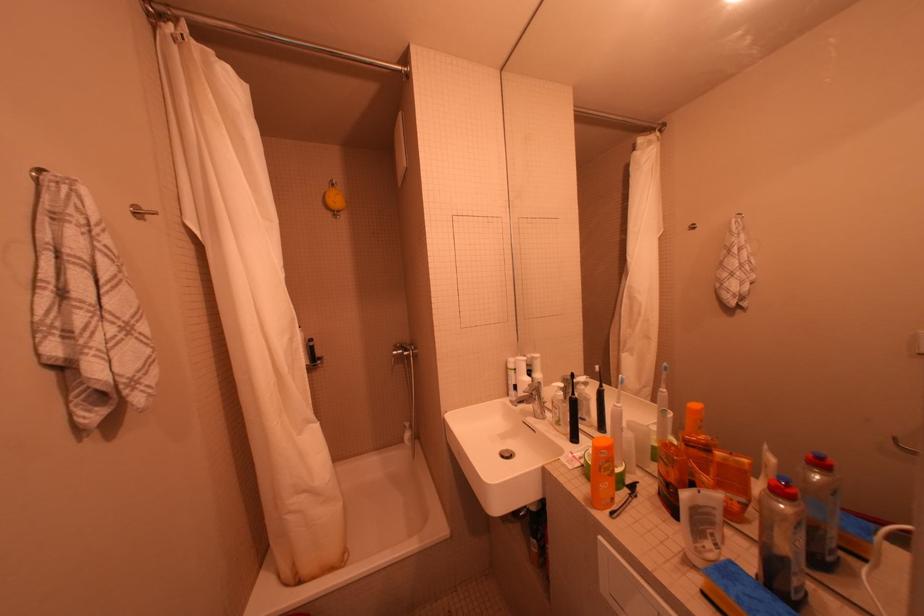
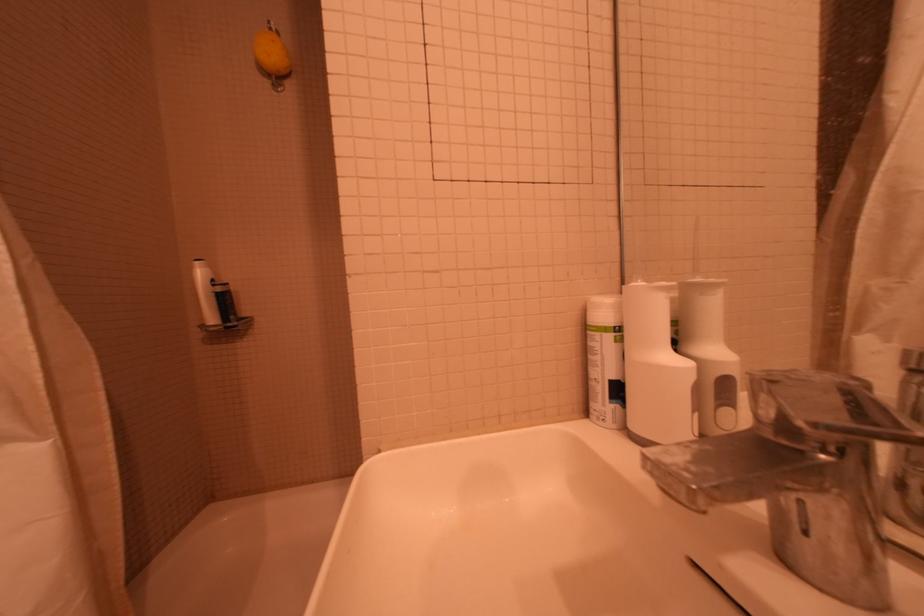
In the second image, find the point that corresponds to the point at 516,370 in the first image.

(593, 330)